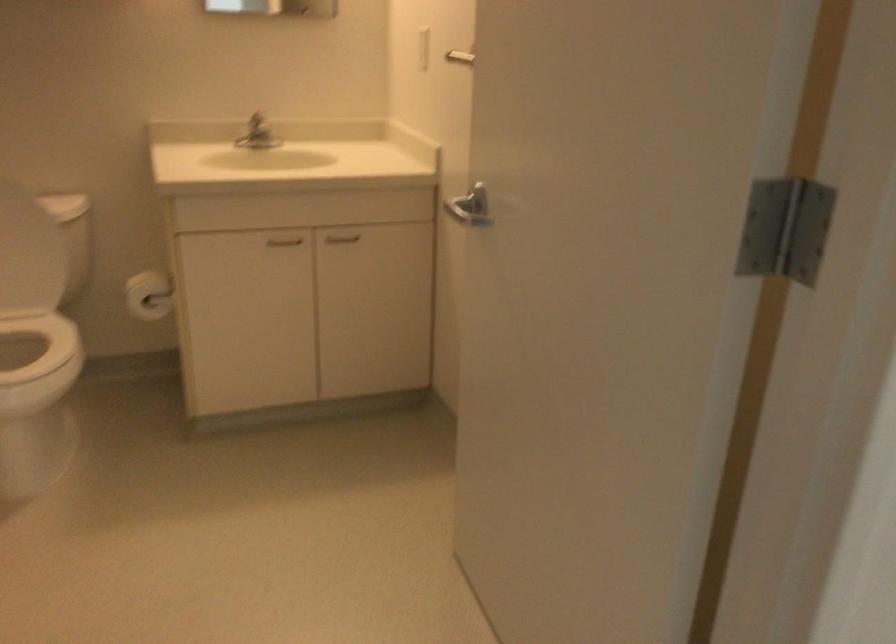
Where is `toilet paper holder`? Image resolution: width=896 pixels, height=644 pixels. toilet paper holder is located at coordinates (149, 295).